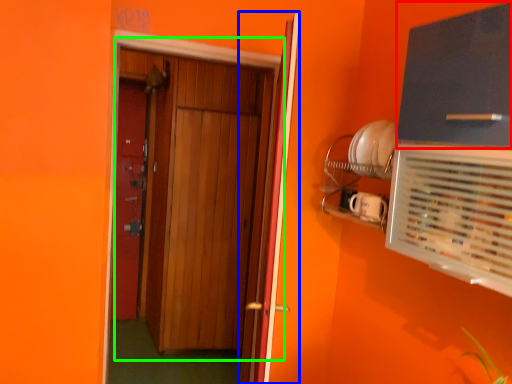
Question: Based on their relative distances, which object is nearer to cabinetry (highlighted by a red box)? Choose from door (highlighted by a blue box) and door (highlighted by a green box).

Choices:
 (A) door
 (B) door

Answer: (A)